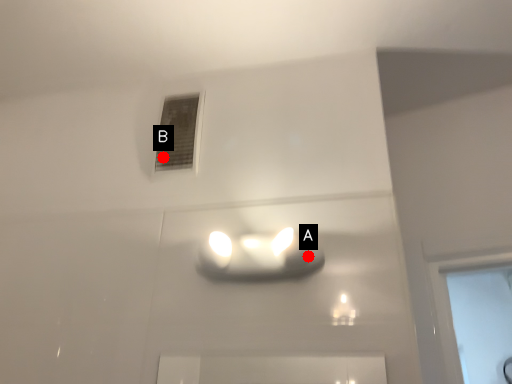
Question: Two points are circled on the image, labeled by A and B beside each circle. Which point is farther from the camera taking this photo?

Choices:
 (A) A is further
 (B) B is further

Answer: (B)